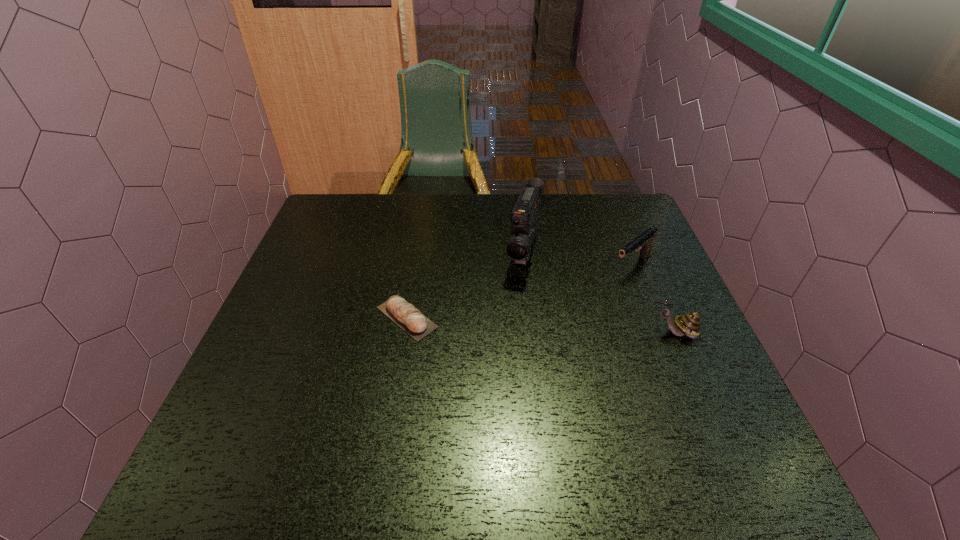
What are the coordinates of `vacant space in between the leftmost object and the snail` in the screenshot? It's located at point(541,326).

Locate an element on the screen. The image size is (960, 540). blank region between the second object from left to right and the pistol is located at coordinates (578, 259).

Locate an element on the screen. This screenshot has width=960, height=540. free space between the pistol and the third object from right to left is located at coordinates (578, 259).

The width and height of the screenshot is (960, 540). What are the coordinates of `vacant point located between the camcorder and the pita bread` in the screenshot? It's located at (466, 285).

At what (x,y) coordinates should I click in order to perform the action: click on free space that is in between the pistol and the pita bread. Please return your answer as a coordinate pair (x, y). This screenshot has width=960, height=540. Looking at the image, I should click on (519, 292).

I want to click on unoccupied area between the snail and the pistol, so click(x=654, y=300).

In order to click on unoccupied position between the pistol and the snail in this screenshot , I will do `click(654, 300)`.

Point out which object is positioned as the third nearest to the camcorder. Please provide its 2D coordinates. Your answer should be formatted as a tuple, i.e. [(x, y)], where the tuple contains the x and y coordinates of a point satisfying the conditions above.

[(689, 324)]

Where is `object that can be found as the second closest to the snail`? object that can be found as the second closest to the snail is located at coordinates (524, 218).

Where is `free region that satisfies the following two spatial constraints: 1. on the front side of the third object from right to left; 2. on the face of the snail`? The image size is (960, 540). free region that satisfies the following two spatial constraints: 1. on the front side of the third object from right to left; 2. on the face of the snail is located at coordinates (534, 333).